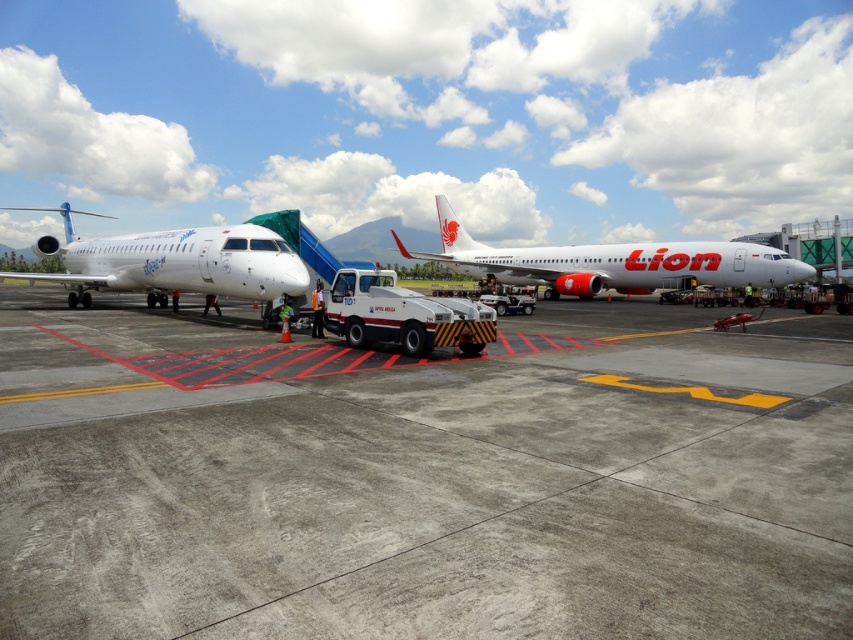
Which is in front, point (802, 550) or point (141, 250)?

Point (802, 550) is more forward.

Identify the location of gray concrete tarmac at center. [422, 477].

The height and width of the screenshot is (640, 853). Describe the element at coordinates (172, 262) in the screenshot. I see `white glossy airplane at left` at that location.

Where is `white glossy airplane at left`? The height and width of the screenshot is (640, 853). white glossy airplane at left is located at coordinates (172, 262).

The height and width of the screenshot is (640, 853). Find the location of `white glossy airplane at left`. white glossy airplane at left is located at coordinates (172, 262).

Does gray concrete tarmac at center appear over white matte airplane at center?

Incorrect, gray concrete tarmac at center is not positioned above white matte airplane at center.

In the scene shown: Who is higher up, gray concrete tarmac at center or white matte airplane at center?

white matte airplane at center is above.

In order to click on gray concrete tarmac at center in this screenshot , I will do `click(422, 477)`.